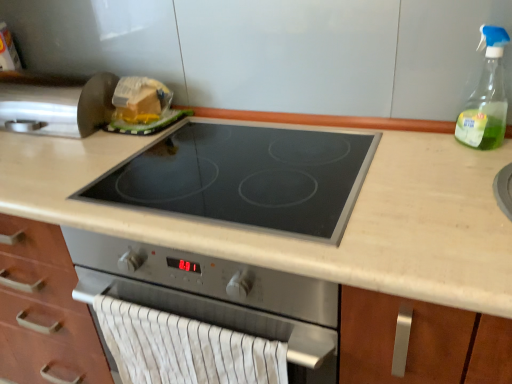
Find the location of a particular element. The width and height of the screenshot is (512, 384). empty space that is ontop of black glass cooktop at center (from a real-world perspective) is located at coordinates (245, 165).